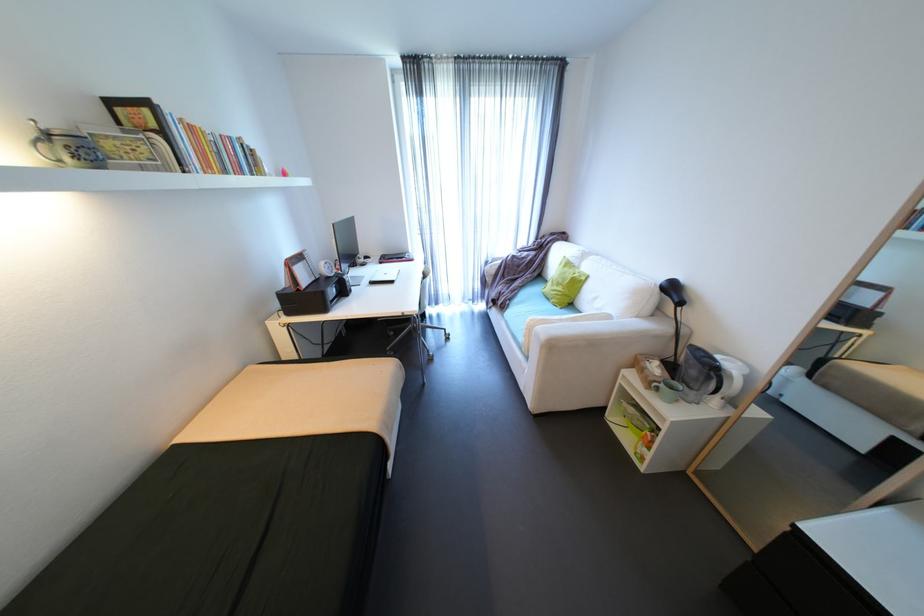
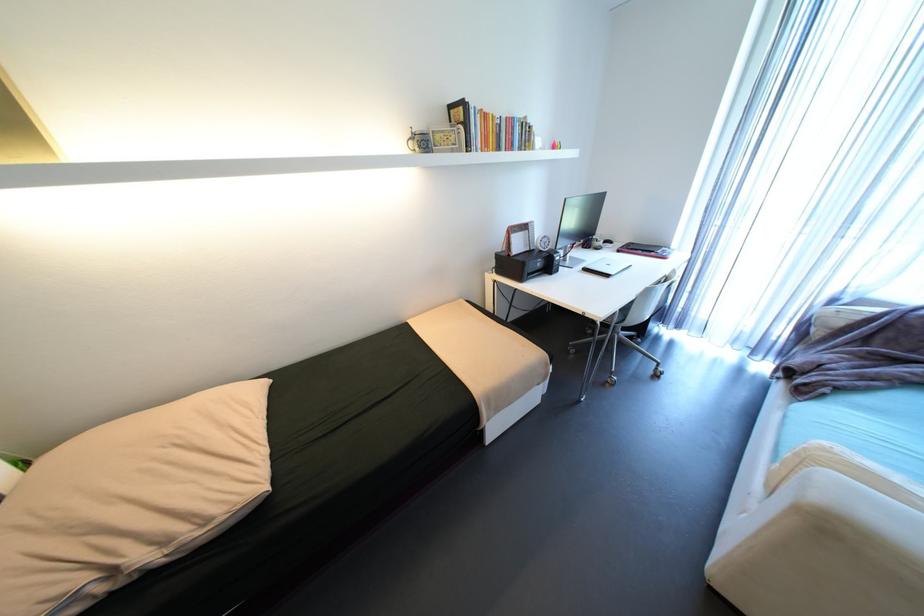
How did the camera likely rotate?

The camera rotated toward left-down.